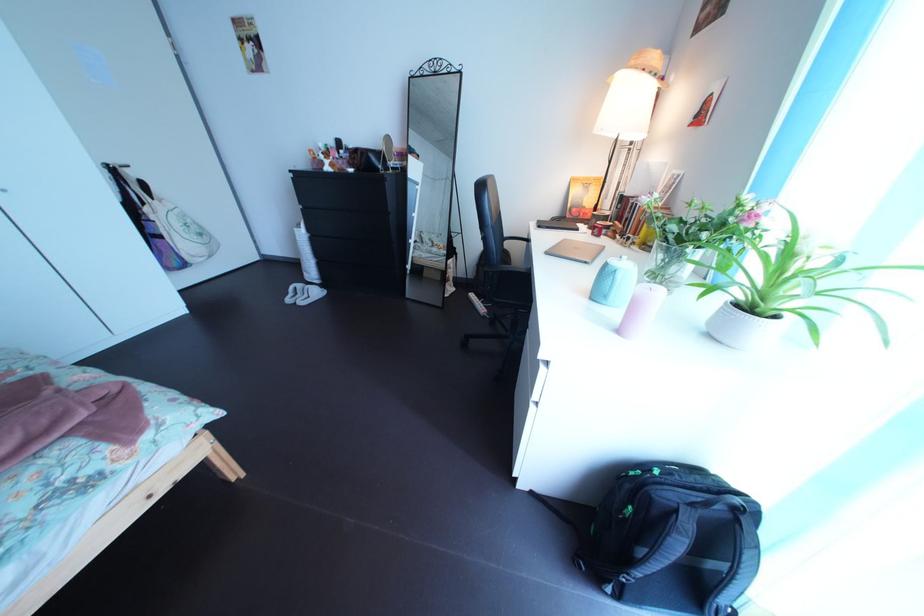
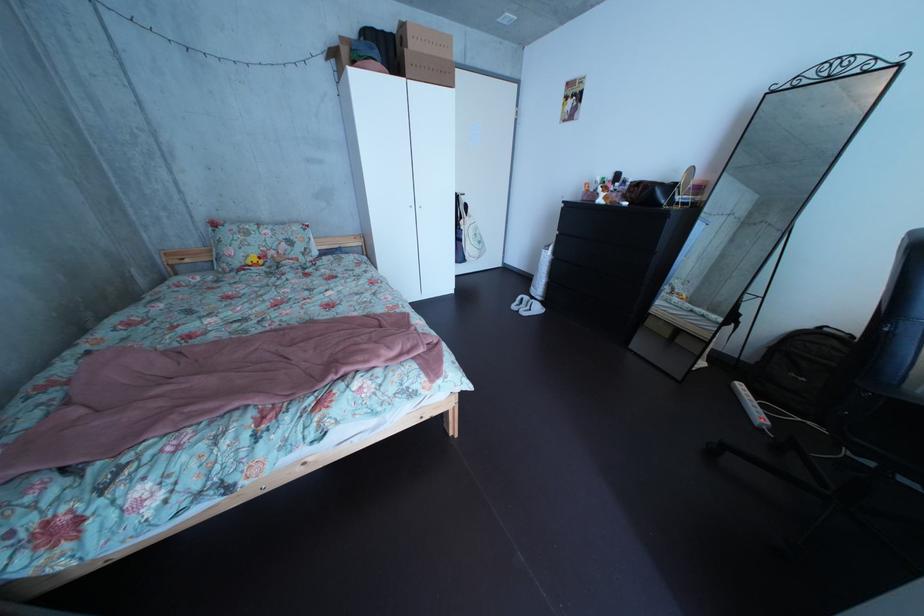
Locate, in the second image, the point that corresponds to point 313,294 in the first image.

(541, 306)